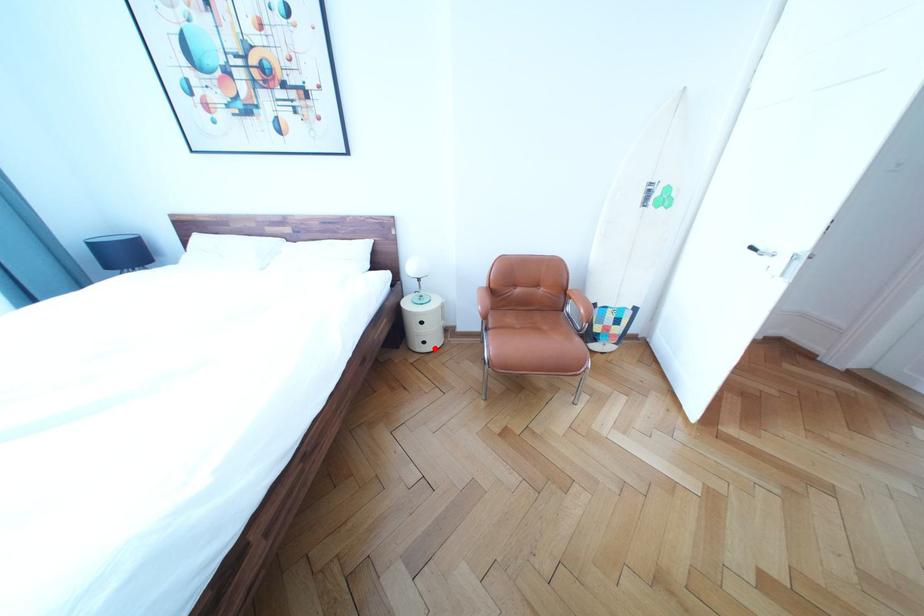
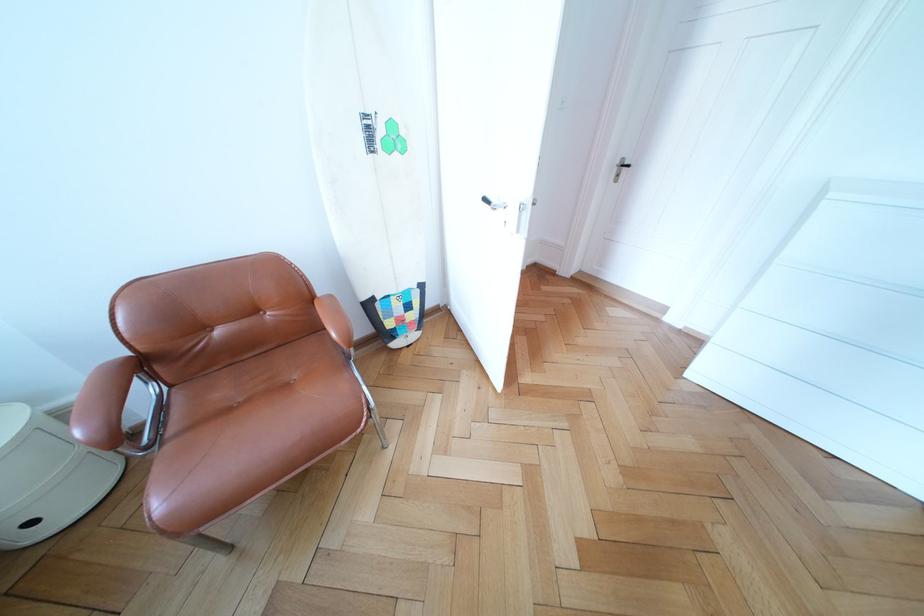
Question: I am providing you with two images of the same scene from different viewpoints. In image1, a red point is highlighted. Considering the same 3D point in image2, which of the following is correct?

Choices:
 (A) It is closer
 (B) It is farther

Answer: (B)